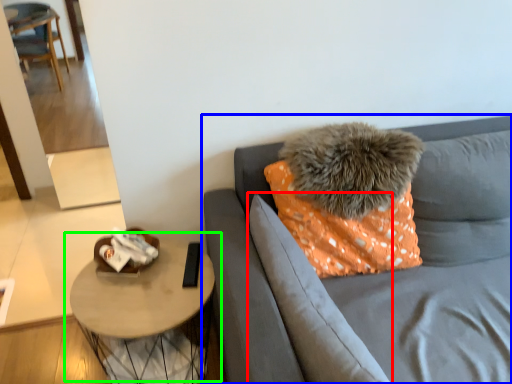
Question: Based on their relative distances, which object is farther from pillow (highlighted by a red box)? Choose from studio couch (highlighted by a blue box) and table (highlighted by a green box).

Choices:
 (A) studio couch
 (B) table

Answer: (B)